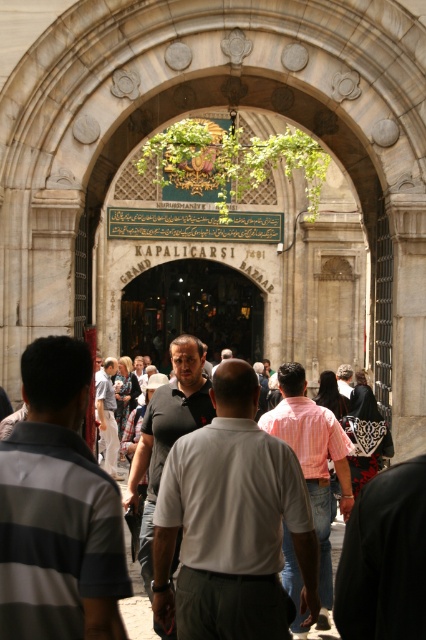
Is pink striped shirt at center thinner than light gray shirt at center?

No.

Based on the photo, who is taller, pink striped shirt at center or light gray shirt at center?

With more height is pink striped shirt at center.

Describe the element at coordinates (313, 461) in the screenshot. I see `pink striped shirt at center` at that location.

Identify the location of pink striped shirt at center. (313, 461).

Does gray striped shirt at center have a larger size compared to pink striped shirt at center?

No.

Does gray striped shirt at center appear on the left side of pink striped shirt at center?

Yes, gray striped shirt at center is to the left of pink striped shirt at center.

Between point (103, 588) and point (308, 444), which one is positioned in front?

Point (103, 588)

Where is `gray striped shirt at center`? gray striped shirt at center is located at coordinates (57, 509).

Between white matte shirt at center and gray striped shirt at center, which one is positioned higher?

gray striped shirt at center is above.

Does white matte shirt at center have a greater height compared to gray striped shirt at center?

Correct, white matte shirt at center is much taller as gray striped shirt at center.

Between point (216, 449) and point (78, 480), which one is positioned behind?

Point (216, 449)

I want to click on white matte shirt at center, so click(x=232, y=522).